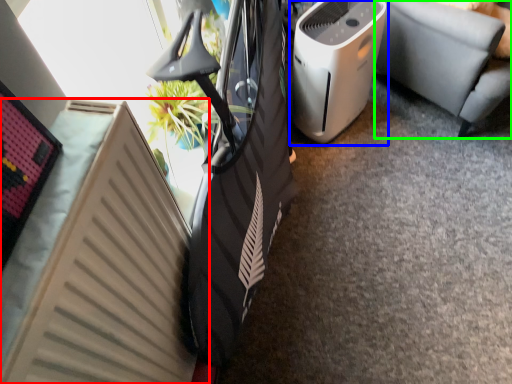
Question: Which is nearer to the radiator (highlighted by a red box)? home appliance (highlighted by a blue box) or furniture (highlighted by a green box).

Choices:
 (A) home appliance
 (B) furniture

Answer: (A)